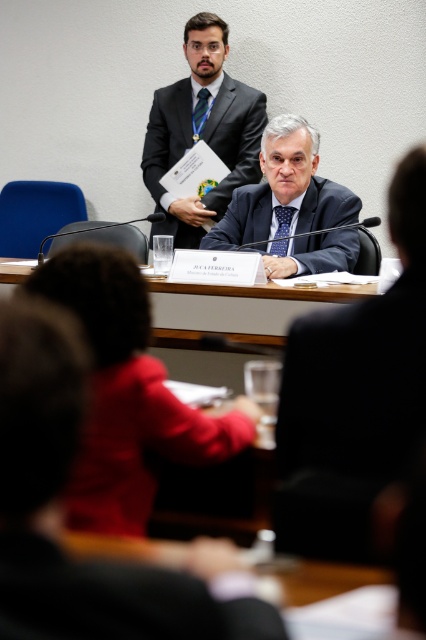
You are an event organizer and need to arrange seating for a photo. You have two items to place on the table in the scene described. The items are the matte black jacket at center and the matte black suit at upper center. Based on their positions, which item should you place closer to the edge of the table to ensure proper alignment with the background?

The matte black jacket at center should be placed closer to the edge of the table because it is located below the matte black suit at upper center, meaning it is positioned lower and nearer to the table edge compared to the suit which is higher up.

You are attending a formal event and notice two men dressed in black attire. One is wearing a matte black jacket at center and the other a matte black suit at upper center. Which of these two items is shorter in height?

The matte black jacket at center is shorter in height compared to the matte black suit at upper center.

Based on the scene description, can you determine the spatial relationship between the black fabric business suit at center and the matte black suit at upper center?

The black fabric business suit at center is located below the matte black suit at upper center.